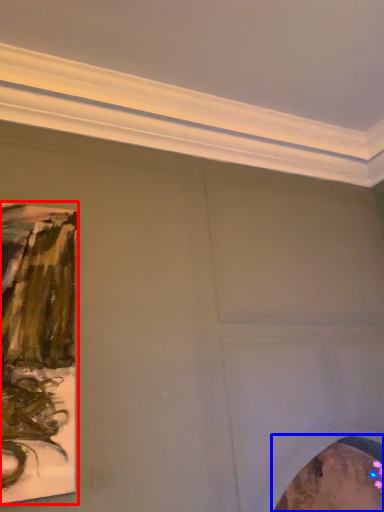
Question: Which point is closer to the camera, picture frame (highlighted by a red box) or picture frame (highlighted by a blue box)?

Choices:
 (A) picture frame
 (B) picture frame

Answer: (A)